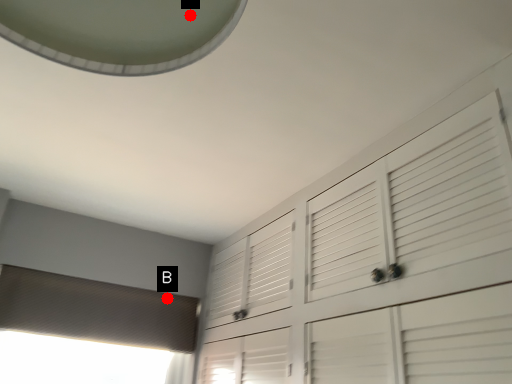
Question: Two points are circled on the image, labeled by A and B beside each circle. Which point is farther to the camera?

Choices:
 (A) A is further
 (B) B is further

Answer: (B)